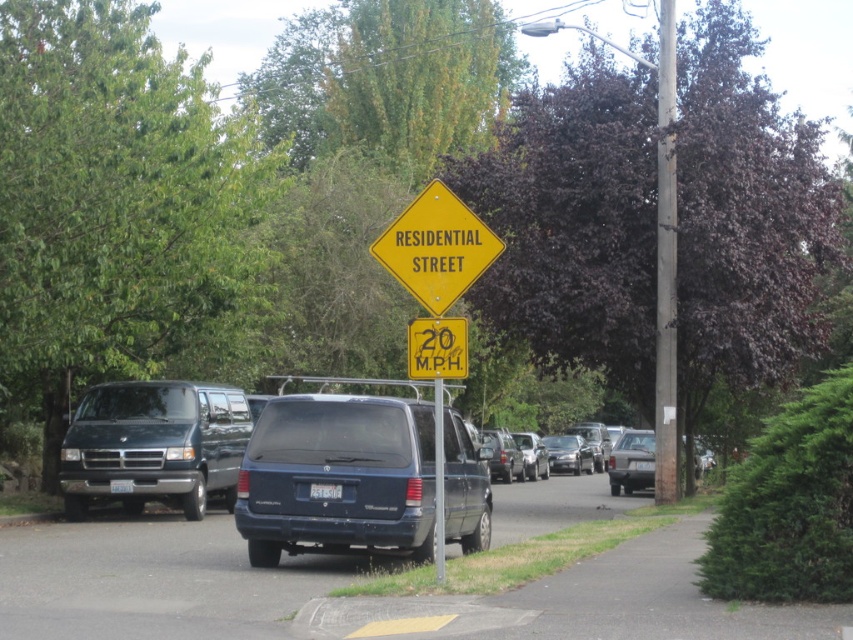
You are standing at the point marked by the coordinates point [194,444]. You want to walk to the nearest parked van on the left side of the street. How far will you have to walk?

The distance between you and the parked van is 53.77 feet, so you will have to walk 53.77 feet to reach it.

You are standing at the point labeled point (491, 461) and want to walk towards the camera. Which direction should you move to get closer to the camera without passing point (674, 458)?

You should move towards point (674, 458) because it is closer to the camera than point (491, 461).